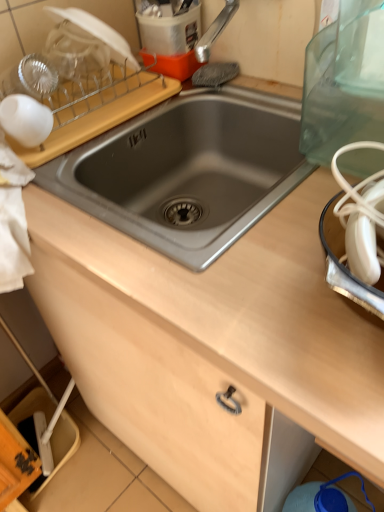
Where is `clear glass dish rack at upper left`? clear glass dish rack at upper left is located at coordinates (86, 87).

Describe the element at coordinates (86, 87) in the screenshot. This screenshot has height=512, width=384. I see `clear glass dish rack at upper left` at that location.

Measure the distance between clear glass dish rack at upper left and camera.

They are 74.60 centimeters apart.

The height and width of the screenshot is (512, 384). Identify the location of clear glass dish rack at upper left. (86, 87).